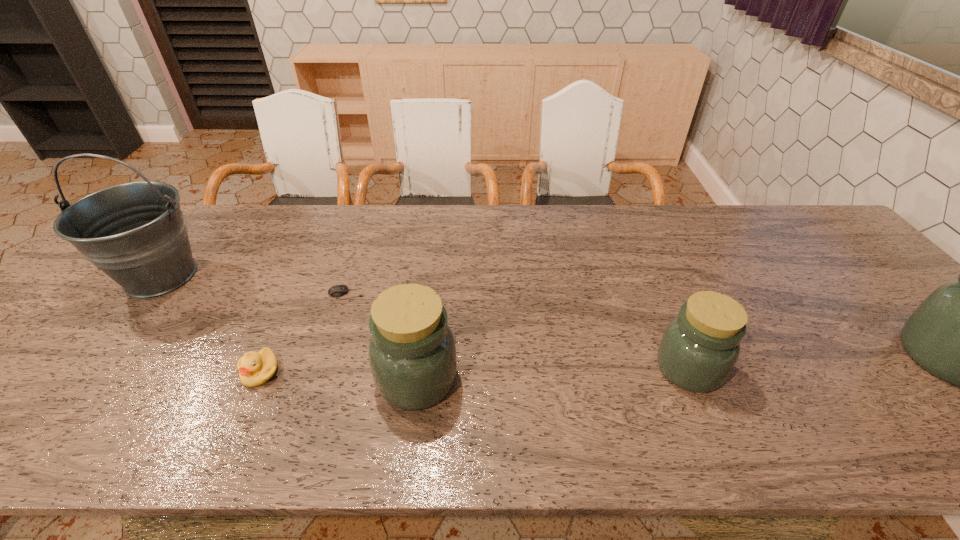
Locate which jar is the closest to the fourth object from right to left. Please provide its 2D coordinates. Your answer should be formatted as a tuple, i.e. [(x, y)], where the tuple contains the x and y coordinates of a point satisfying the conditions above.

[(412, 353)]

Point out which jar is positioned as the nearest to the rightmost object. Please provide its 2D coordinates. Your answer should be formatted as a tuple, i.e. [(x, y)], where the tuple contains the x and y coordinates of a point satisfying the conditions above.

[(700, 347)]

Where is `vacant region that satisfies the following two spatial constraints: 1. on the front side of the second jar from left to right; 2. on the right side of the mouse`? This screenshot has width=960, height=540. vacant region that satisfies the following two spatial constraints: 1. on the front side of the second jar from left to right; 2. on the right side of the mouse is located at coordinates (323, 368).